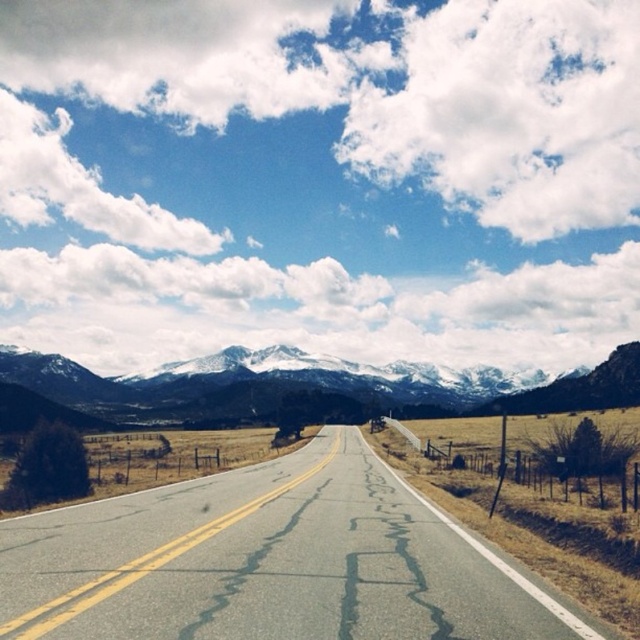
You are driving a car and see the asphalt road at center leading towards the snowy granite mountains at center. Which one is closer to you?

The asphalt road at center is closer to you because it is positioned in front of the snowy granite mountains at center.

You are a driver approaching the asphalt road at center and the snowy granite mountains at center. Which one appears narrower from your perspective?

The asphalt road at center is thinner than snowy granite mountains at center, so the asphalt road at center appears narrower from your perspective.

You are standing at the point marked by coordinates point (269, 561). Looking around, you see the asphalt road at center. Which direction should you walk to stay on the asphalt road at center?

The asphalt road at center is represented by point (269, 561), so you are already standing on the asphalt road at center. You can continue walking forward along the road to stay on it.